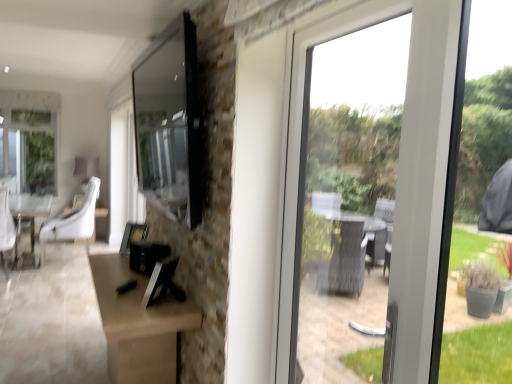
Question: Can you confirm if matte black tv at upper center is taller than white fabric chair at center?

Choices:
 (A) no
 (B) yes

Answer: (A)

Question: From a real-world perspective, is matte black tv at upper center below white fabric chair at center?

Choices:
 (A) no
 (B) yes

Answer: (A)

Question: Is matte black tv at upper center far from white fabric chair at center?

Choices:
 (A) no
 (B) yes

Answer: (B)

Question: Is matte black tv at upper center oriented away from white fabric chair at center?

Choices:
 (A) no
 (B) yes

Answer: (A)

Question: From the image's perspective, is matte black tv at upper center above white fabric chair at center?

Choices:
 (A) yes
 (B) no

Answer: (A)

Question: Considering the relative sizes of matte black tv at upper center and white fabric chair at center in the image provided, is matte black tv at upper center bigger than white fabric chair at center?

Choices:
 (A) yes
 (B) no

Answer: (B)

Question: Considering the relative sizes of white fabric chair at center and matte black tv at upper center in the image provided, is white fabric chair at center thinner than matte black tv at upper center?

Choices:
 (A) no
 (B) yes

Answer: (A)

Question: Could you tell me if white fabric chair at center is facing matte black tv at upper center?

Choices:
 (A) no
 (B) yes

Answer: (A)

Question: From a real-world perspective, does white fabric chair at center sit lower than matte black tv at upper center?

Choices:
 (A) no
 (B) yes

Answer: (B)

Question: Can you confirm if white fabric chair at center is positioned to the right of matte black tv at upper center?

Choices:
 (A) no
 (B) yes

Answer: (A)

Question: Is white fabric chair at center next to matte black tv at upper center?

Choices:
 (A) no
 (B) yes

Answer: (A)

Question: Does white fabric chair at center have a greater width compared to matte black tv at upper center?

Choices:
 (A) no
 (B) yes

Answer: (B)

Question: From a real-world perspective, does matte black tv at upper center sit lower than white leather swivel chair at left?

Choices:
 (A) no
 (B) yes

Answer: (A)